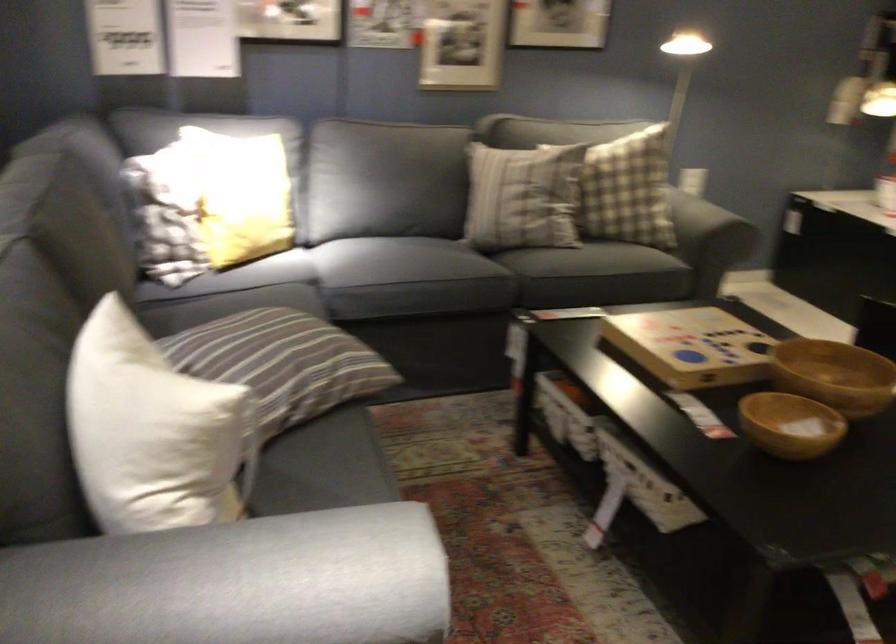
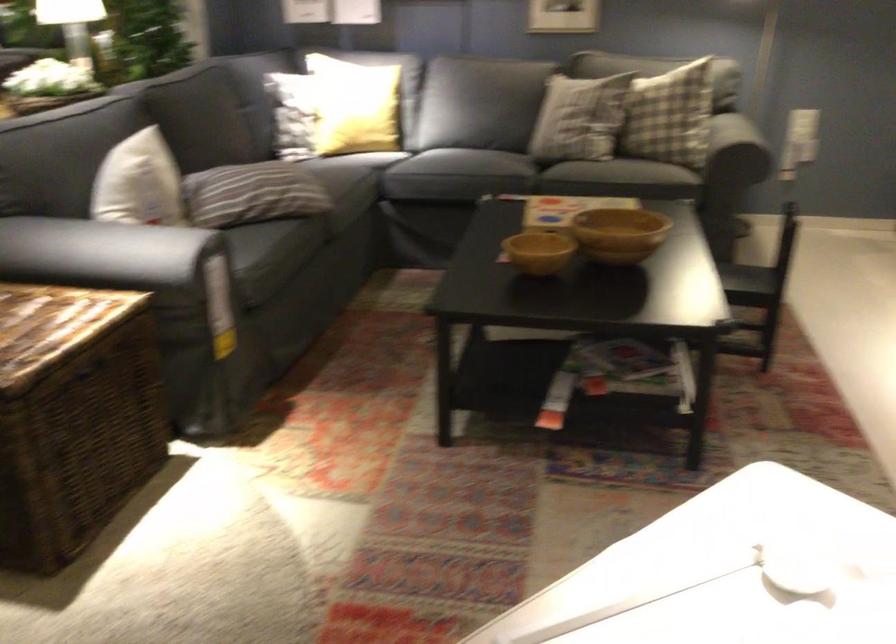
Locate, in the second image, the point that corresponds to [814,375] in the first image.

(618, 234)